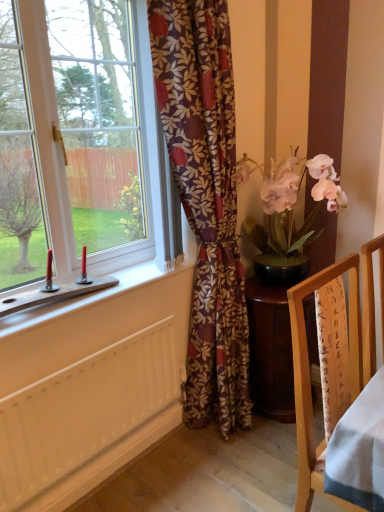
Question: From the image's perspective, does white painted wood radiator at lower left appear higher than white plastic window at left?

Choices:
 (A) yes
 (B) no

Answer: (B)

Question: Is white painted wood radiator at lower left turned away from white plastic window at left?

Choices:
 (A) yes
 (B) no

Answer: (B)

Question: From a real-world perspective, is white painted wood radiator at lower left located higher than white plastic window at left?

Choices:
 (A) no
 (B) yes

Answer: (A)

Question: Does white painted wood radiator at lower left appear on the left side of white plastic window at left?

Choices:
 (A) no
 (B) yes

Answer: (A)

Question: Are white painted wood radiator at lower left and white plastic window at left beside each other?

Choices:
 (A) no
 (B) yes

Answer: (A)

Question: Does white painted wood radiator at lower left have a greater height compared to white plastic window at left?

Choices:
 (A) no
 (B) yes

Answer: (A)

Question: Can you confirm if pink silk orchid at right is positioned to the right of floral-patterned fabric at center?

Choices:
 (A) yes
 (B) no

Answer: (A)

Question: From a real-world perspective, does pink silk orchid at right stand above floral-patterned fabric at center?

Choices:
 (A) no
 (B) yes

Answer: (B)

Question: Is pink silk orchid at right taller than floral-patterned fabric at center?

Choices:
 (A) yes
 (B) no

Answer: (B)

Question: Is pink silk orchid at right at the left side of floral-patterned fabric at center?

Choices:
 (A) yes
 (B) no

Answer: (B)

Question: Is pink silk orchid at right thinner than floral-patterned fabric at center?

Choices:
 (A) no
 (B) yes

Answer: (A)

Question: Considering the relative sizes of pink silk orchid at right and floral-patterned fabric at center in the image provided, is pink silk orchid at right bigger than floral-patterned fabric at center?

Choices:
 (A) no
 (B) yes

Answer: (A)

Question: Does wooden frame at right lie in front of floral-patterned fabric at center?

Choices:
 (A) yes
 (B) no

Answer: (A)